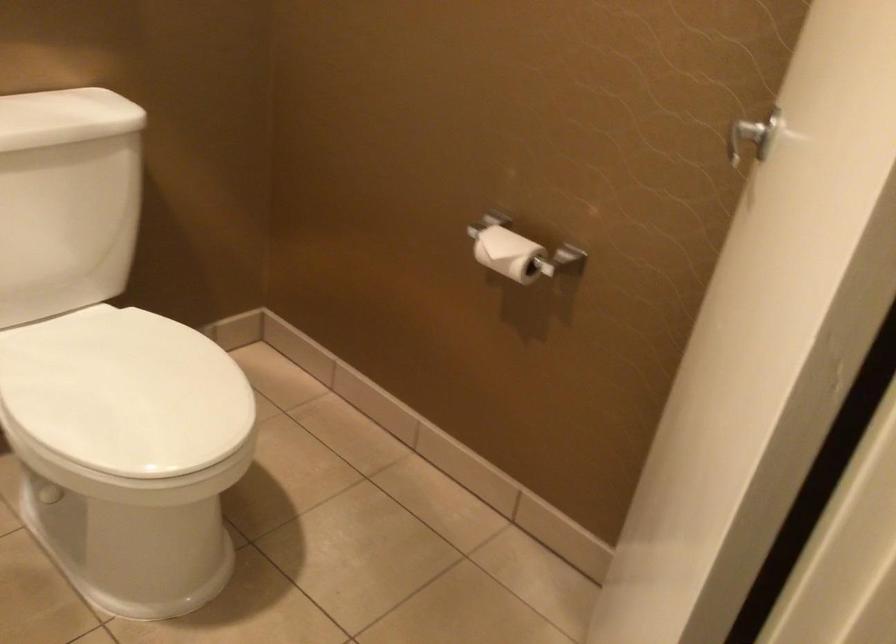
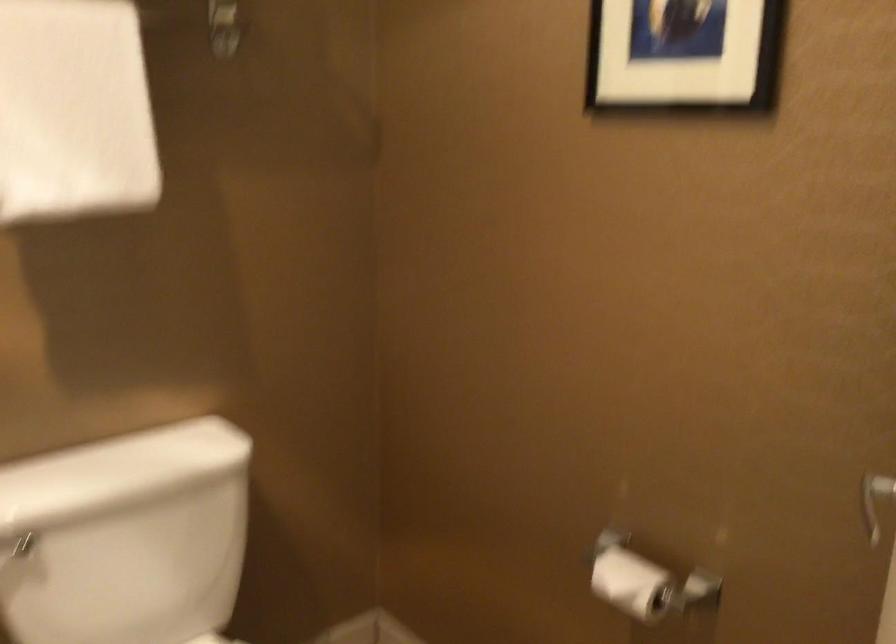
In the scene shown: The images are taken continuously from a first-person perspective. In which direction are you moving?

The movement direction of the cameraman is right, forward.